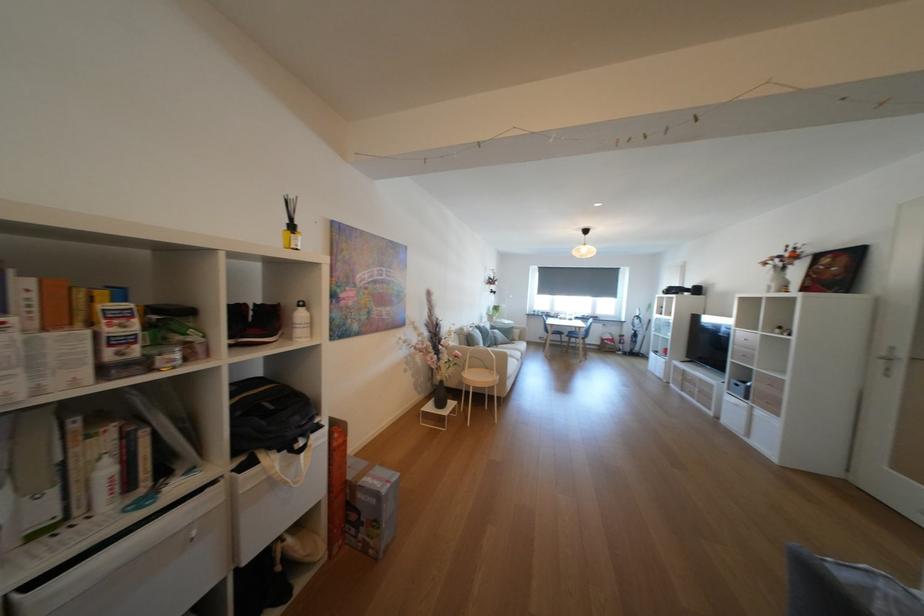
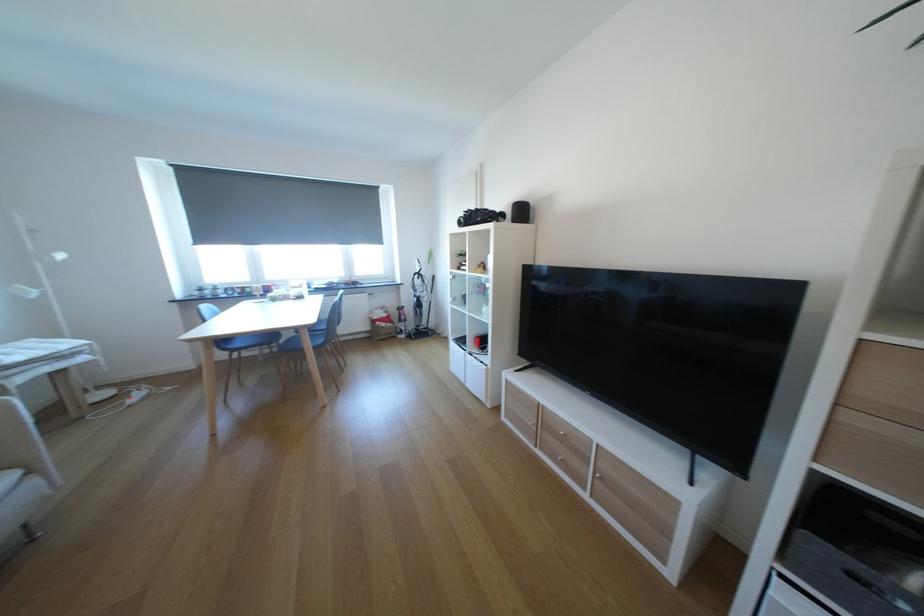
Question: I am providing you with two images of the same scene from different viewpoints. After the viewpoint changes to image2, which objects are now occluded?

Choices:
 (A) sofa sitting surface
 (B) blue chair sitting surface
 (C) black toy vehicle
 (D) none of these

Answer: (D)